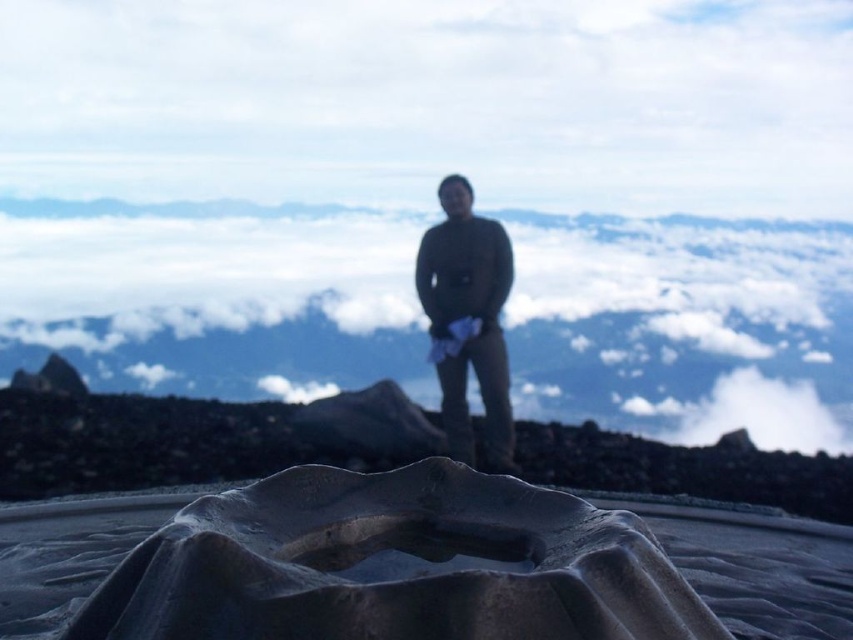
You are standing at the point with coordinates point (77, 460) and want to walk towards the horizon. Will the point with coordinates point (614, 305) block your view?

Point (614, 305) is behind point (77, 460), so it will not block your view when walking towards the horizon from point (77, 460).

You are standing on the rock in the foreground and want to point to the white fluffy cloud at upper center. What are the coordinates where you should point?

You should point to the coordinates at point (213,296) where the white fluffy cloud at upper center is located.

You are an artist trying to paint the scene. You want to ensure the white fluffy cloud at upper center and the rough textured rock at center are proportionally accurate. Given that the rock is 2 meters wide, how wide should you paint the cloud?

The distance between the white fluffy cloud at upper center and the rough textured rock at center is 3.76 centimeters. Since the rock is 2 meters wide, the cloud should be painted proportionally based on their actual sizes and distance in the scene. However, without knowing the actual distance between them or the scale of the painting, an exact width cannot be determined. Consider using the rock as a reference for relative size.